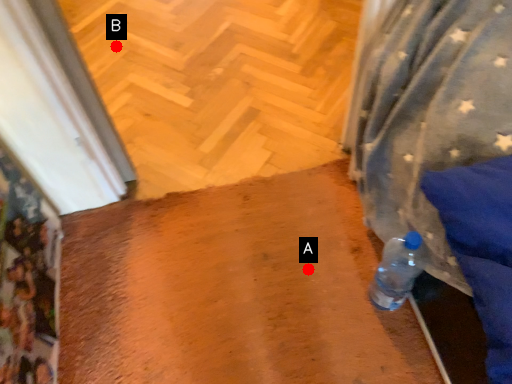
Question: Two points are circled on the image, labeled by A and B beside each circle. Which point is farther to the camera?

Choices:
 (A) A is further
 (B) B is further

Answer: (B)